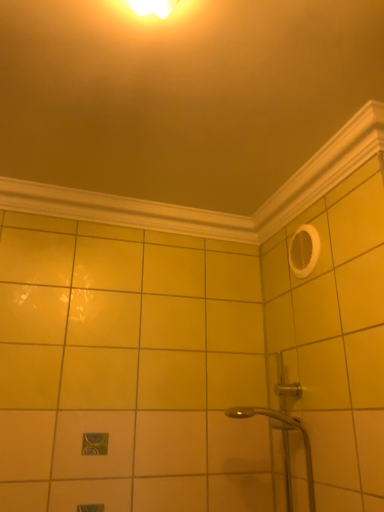
Question: From the image's perspective, is white wood molding at upper center, which appears as the 1th molding when ordered from the bottom, located above or below white glossy molding at upper center, the first molding in the top-to-bottom sequence?

Choices:
 (A) above
 (B) below

Answer: (B)

Question: Would you say white wood molding at upper center, which appears as the 1th molding when ordered from the bottom, is inside or outside white glossy molding at upper center, the second molding ordered from the bottom?

Choices:
 (A) inside
 (B) outside

Answer: (B)

Question: From a real-world perspective, relative to white glossy molding at upper center, the first molding in the top-to-bottom sequence, is white wood molding at upper center, the 2th molding viewed from the top, vertically above or below?

Choices:
 (A) above
 (B) below

Answer: (B)

Question: Is white glossy molding at upper center, the first molding in the top-to-bottom sequence, situated inside white wood molding at upper center, which appears as the 1th molding when ordered from the bottom, or outside?

Choices:
 (A) inside
 (B) outside

Answer: (B)

Question: Is white glossy molding at upper center, the first molding in the top-to-bottom sequence, to the left or to the right of white wood molding at upper center, the 2th molding viewed from the top, in the image?

Choices:
 (A) right
 (B) left

Answer: (A)

Question: From a real-world perspective, is white glossy molding at upper center, the first molding in the top-to-bottom sequence, positioned above or below white wood molding at upper center, the 2th molding viewed from the top?

Choices:
 (A) below
 (B) above

Answer: (B)

Question: In terms of size, does white glossy molding at upper center, the second molding ordered from the bottom, appear bigger or smaller than white wood molding at upper center, which appears as the 1th molding when ordered from the bottom?

Choices:
 (A) small
 (B) big

Answer: (B)